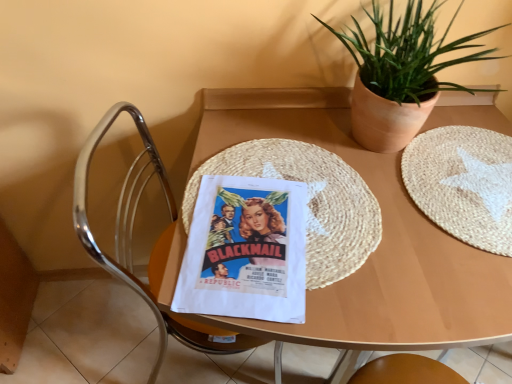
Locate an element on the screen. This screenshot has height=384, width=512. vacant space situated above wooden placemat at center (from a real-world perspective) is located at coordinates (346, 213).